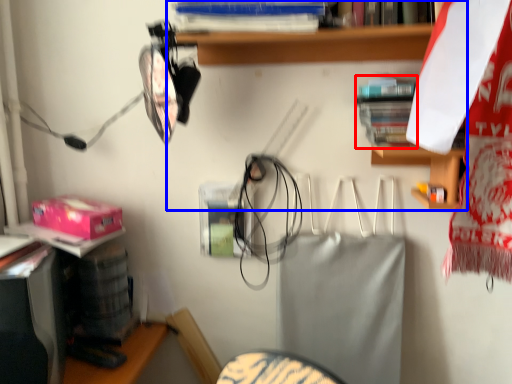
Question: Which of the following is the closest to the observer, book (highlighted by a red box) or shelf (highlighted by a blue box)?

Choices:
 (A) book
 (B) shelf

Answer: (B)